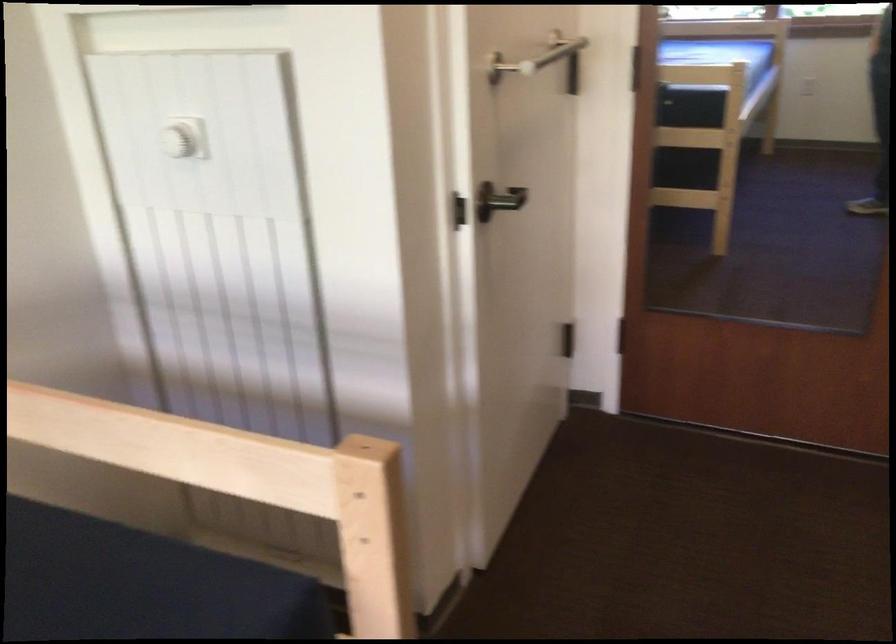
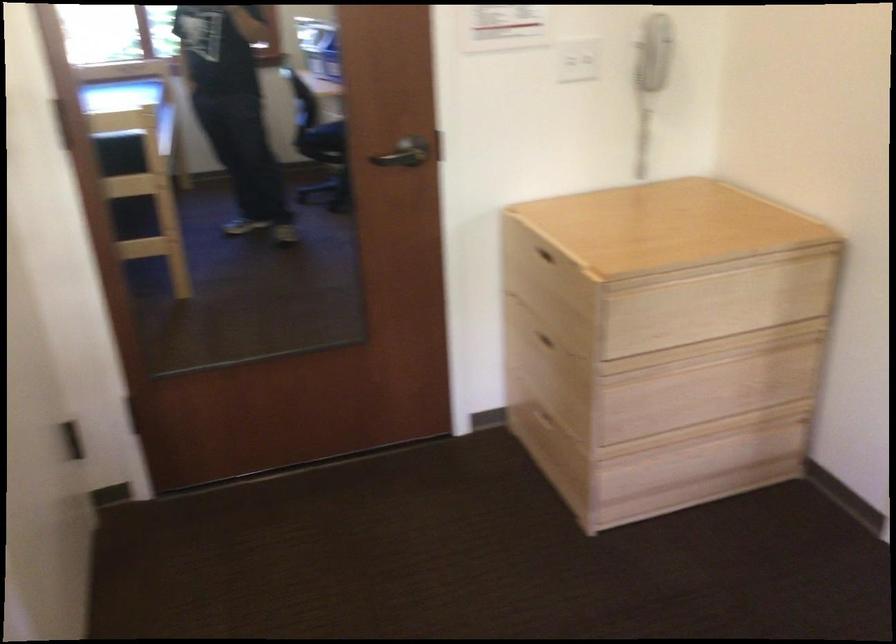
Question: The first image is from the beginning of the video and the second image is from the end. How did the camera likely rotate when shooting the video?

Choices:
 (A) Left
 (B) Right
 (C) Up
 (D) Down

Answer: (B)